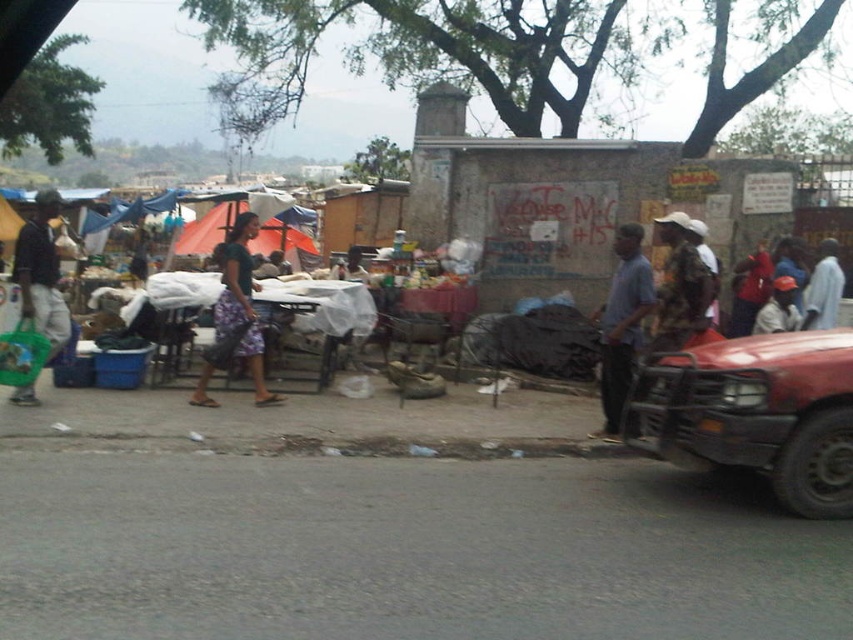
Question: Which point is farther to the camera?

Choices:
 (A) orange fabric tent at center
 (B) white matte shirt at right
 (C) orange fabric cap at lower right

Answer: (A)

Question: Does matte green plastic bag at left have a lesser width compared to white matte shirt at right?

Choices:
 (A) yes
 (B) no

Answer: (B)

Question: Which of the following is the farthest from the observer?

Choices:
 (A) 735,308
 (B) 613,352

Answer: (A)

Question: Which point is farther to the camera?

Choices:
 (A) (35, 209)
 (B) (311, 244)
 (C) (198, 392)
 (D) (820, 316)

Answer: (A)

Question: Is matte green plastic bag at left closer to camera compared to orange fabric tent at center?

Choices:
 (A) yes
 (B) no

Answer: (A)

Question: Can you confirm if shiny red truck at right is smaller than red matte shirt at center?

Choices:
 (A) yes
 (B) no

Answer: (B)